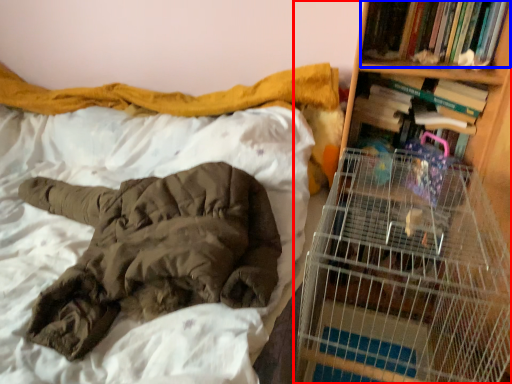
Question: Which object appears farthest to the camera in this image, bookcase (highlighted by a red box) or book (highlighted by a blue box)?

Choices:
 (A) bookcase
 (B) book

Answer: (B)